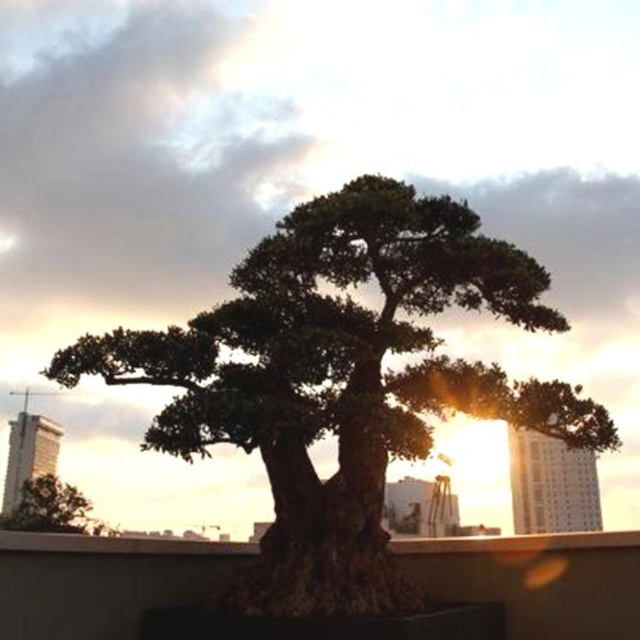
Question: Which of the following is the farthest from the observer?

Choices:
 (A) green leafy tree at lower left
 (B) green textured tree at center

Answer: (A)

Question: Is green textured tree at center positioned in front of green leafy tree at lower left?

Choices:
 (A) no
 (B) yes

Answer: (B)

Question: Does green textured tree at center appear under green leafy tree at lower left?

Choices:
 (A) no
 (B) yes

Answer: (A)

Question: Among these points, which one is nearest to the camera?

Choices:
 (A) (58, 513)
 (B) (406, 298)

Answer: (B)

Question: Can you confirm if green textured tree at center is thinner than green leafy tree at lower left?

Choices:
 (A) yes
 (B) no

Answer: (B)